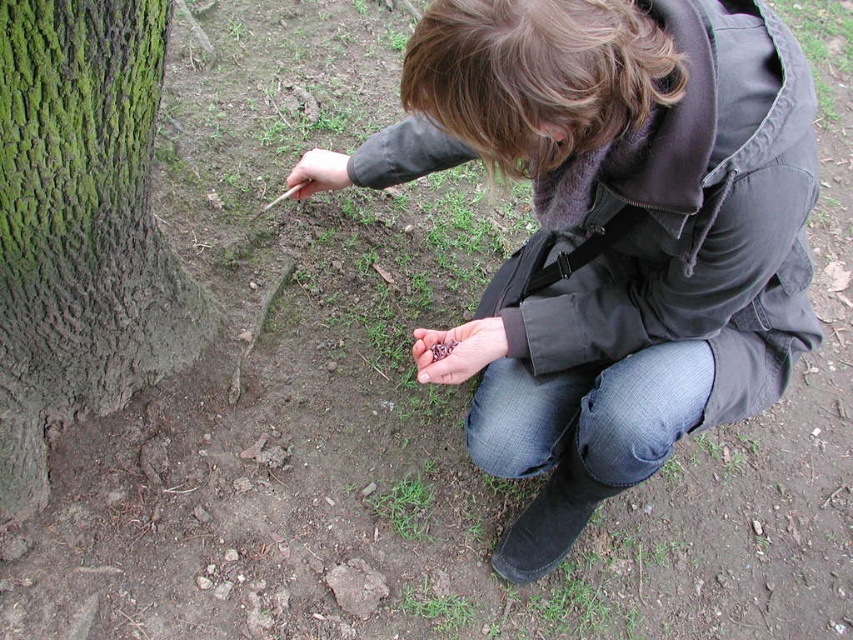
You are standing at the point with coordinates point (30,378) and want to walk to the tree trunk. Which direction should you move to reach the tree trunk first, towards point (624,372) or away from it?

You should move towards point (624,372) because it is in front of point (30,378), meaning it is closer to the tree trunk.

You are a hiker who has just found a shiny rock and wants to place it between the matte black jacket at center and the matte brown stick at center. Based on their positions, which object should you place the rock closer to?

The shiny rock should be placed closer to the matte brown stick at center because the matte black jacket at center is to the right of the matte brown stick at center, so the stick is to the left of the jacket. Placing the rock between them would mean positioning it closer to the stick on the left side.

You are a hiker who just found a matte black jacket at center and a matte brown stick at center on the ground. Which object is closer to the ground?

The matte black jacket at center is closer to the ground because it is positioned below the matte brown stick at center.